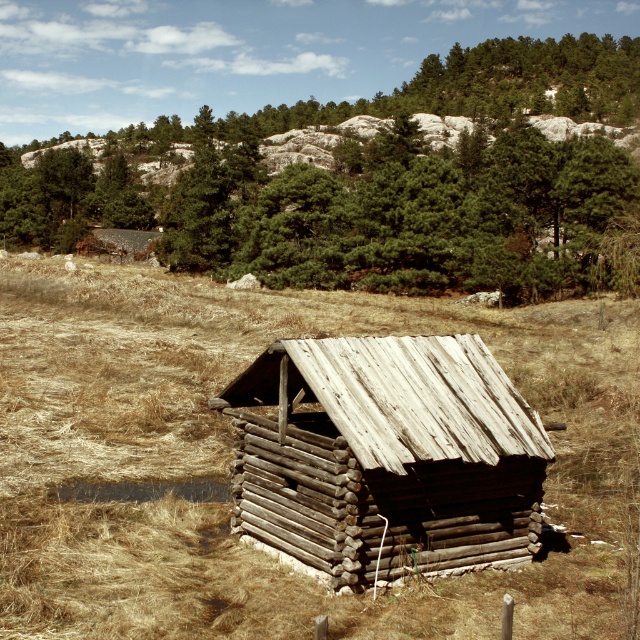
Question: In this image, where is green textured tree at upper center located relative to weathered wood log cabin at center?

Choices:
 (A) left
 (B) right

Answer: (A)

Question: Which object is closer to the camera taking this photo?

Choices:
 (A) weathered wood log cabin at center
 (B) green textured tree at upper center
 (C) brown dry grass at center

Answer: (C)

Question: Estimate the real-world distances between objects in this image. Which object is closer to the green textured tree at upper center?

Choices:
 (A) brown dry grass at center
 (B) weathered wood log cabin at center

Answer: (A)

Question: Does green textured tree at upper center appear over weathered wood log cabin at center?

Choices:
 (A) yes
 (B) no

Answer: (A)

Question: Can you confirm if green textured tree at upper center is bigger than weathered wood log cabin at center?

Choices:
 (A) no
 (B) yes

Answer: (B)

Question: Estimate the real-world distances between objects in this image. Which object is closer to the weathered wood log cabin at center?

Choices:
 (A) brown dry grass at center
 (B) green textured tree at upper center

Answer: (A)